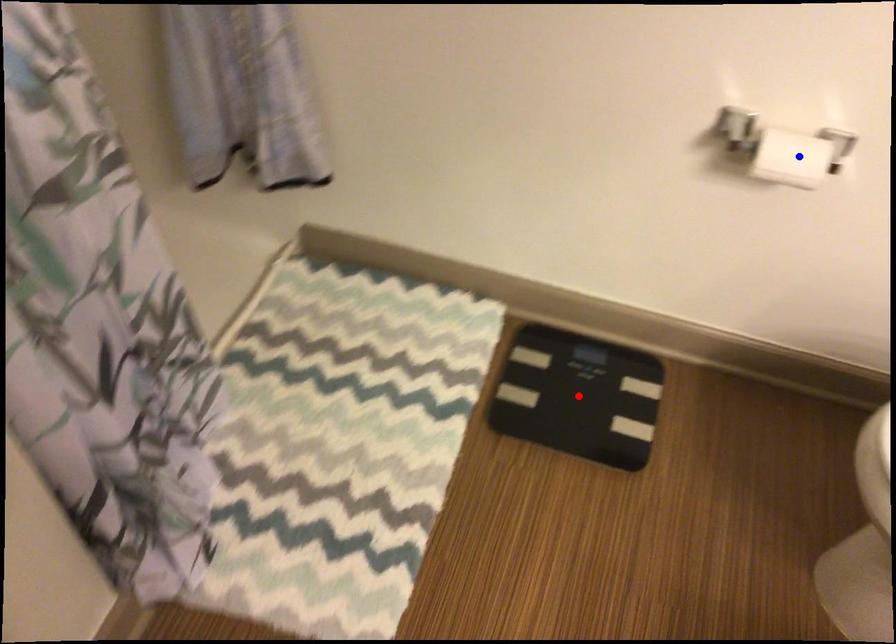
Question: Two points are marked on the image. Which point is closer to the camera?

Choices:
 (A) Blue point is closer.
 (B) Red point is closer.

Answer: (A)